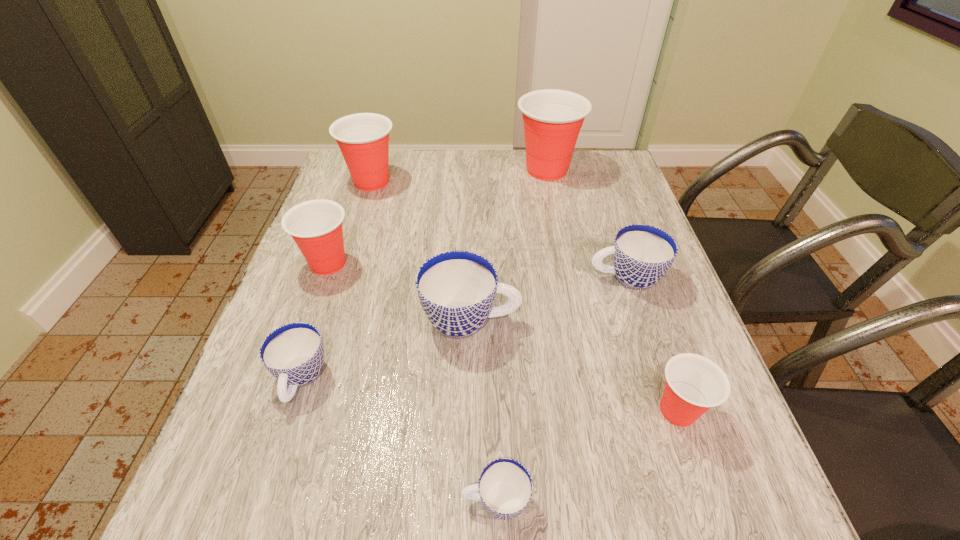
At what (x,y) coordinates should I click in order to perform the action: click on free spot between the shortest cup and the second nearest red cup. Please return your answer as a coordinate pair (x, y). Looking at the image, I should click on (412, 382).

I want to click on object that stands as the seventh closest to the smallest red cup, so [x=363, y=138].

Identify which object is the fourth closest to the seventh tallest cup. Please provide its 2D coordinates. Your answer should be formatted as a tuple, i.e. [(x, y)], where the tuple contains the x and y coordinates of a point satisfying the conditions above.

[(363, 138)]

In order to click on cup identified as the closest to the biggest blue cup in this screenshot , I will do `click(294, 353)`.

Locate which cup is the fifth closest to the third smallest blue cup. Please provide its 2D coordinates. Your answer should be formatted as a tuple, i.e. [(x, y)], where the tuple contains the x and y coordinates of a point satisfying the conditions above.

[(316, 226)]

Where is `the fourth closest red cup to the biggest blue cup`? The image size is (960, 540). the fourth closest red cup to the biggest blue cup is located at coordinates (552, 118).

Select which red cup appears as the third closest to the third biggest red cup. Please provide its 2D coordinates. Your answer should be formatted as a tuple, i.e. [(x, y)], where the tuple contains the x and y coordinates of a point satisfying the conditions above.

[(694, 383)]

At what (x,y) coordinates should I click in order to perform the action: click on the second closest blue cup relative to the tallest object. Please return your answer as a coordinate pair (x, y). This screenshot has width=960, height=540. Looking at the image, I should click on (457, 289).

Identify which blue cup is the third nearest to the leftmost blue cup. Please provide its 2D coordinates. Your answer should be formatted as a tuple, i.e. [(x, y)], where the tuple contains the x and y coordinates of a point satisfying the conditions above.

[(642, 254)]

Identify the location of free space in the image that satisfies the following two spatial constraints: 1. on the back side of the third smallest red cup; 2. on the right side of the third farthest red cup. (357, 181).